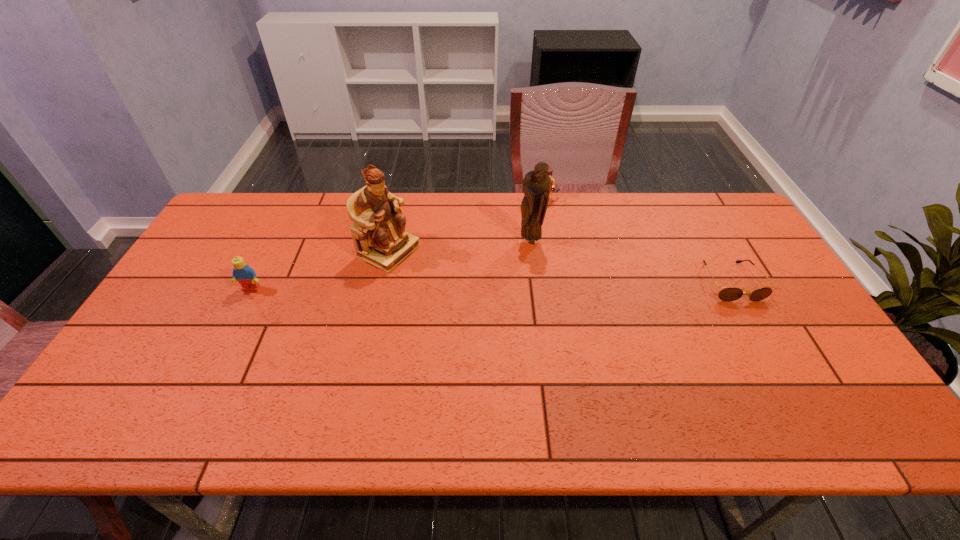
Identify the location of free space on the desktop that is between the nearer Lego and the sunglasses and is positioned on the front-facing side of the second object from left to right. This screenshot has width=960, height=540. click(457, 286).

Find the location of a particular element. vacant space on the desktop that is between the leftmost object and the shortest object and is positioned on the front-facing side of the right figurine is located at coordinates (510, 285).

The image size is (960, 540). I want to click on vacant spot on the desktop that is between the nearer Lego and the sunglasses and is positioned holding a crossbow in the hands of the farthest object, so click(500, 285).